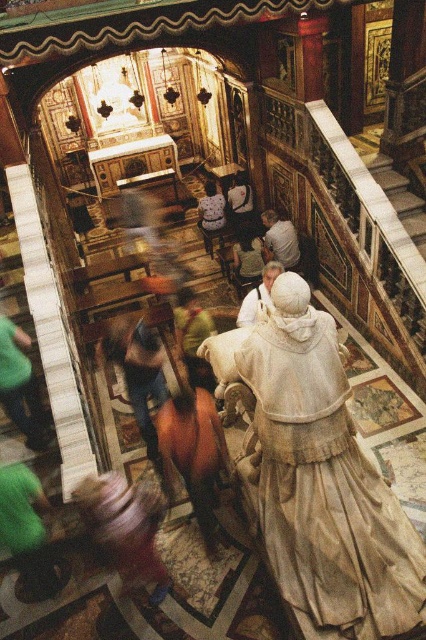
Can you confirm if green fabric shirt at center is smaller than light blue fabric dress at center?

Actually, green fabric shirt at center might be larger than light blue fabric dress at center.

Does green fabric shirt at center have a lesser height compared to light blue fabric dress at center?

Indeed, green fabric shirt at center has a lesser height compared to light blue fabric dress at center.

Is point (192, 301) positioned before point (204, 224)?

Yes.

In order to click on green fabric shirt at center in this screenshot , I will do `click(192, 337)`.

Who is shorter, green fabric shirt at center or light beige fabric at center?

light beige fabric at center is shorter.

Is green fabric shirt at center bigger than light beige fabric at center?

Indeed, green fabric shirt at center has a larger size compared to light beige fabric at center.

The width and height of the screenshot is (426, 640). Identify the location of green fabric shirt at center. (192, 337).

The width and height of the screenshot is (426, 640). I want to click on green fabric shirt at center, so click(192, 337).

Can you confirm if white marble statue at center is positioned to the right of light beige fabric statue at center?

Indeed, white marble statue at center is positioned on the right side of light beige fabric statue at center.

I want to click on white marble statue at center, so [325, 488].

This screenshot has height=640, width=426. I want to click on white marble statue at center, so click(325, 488).